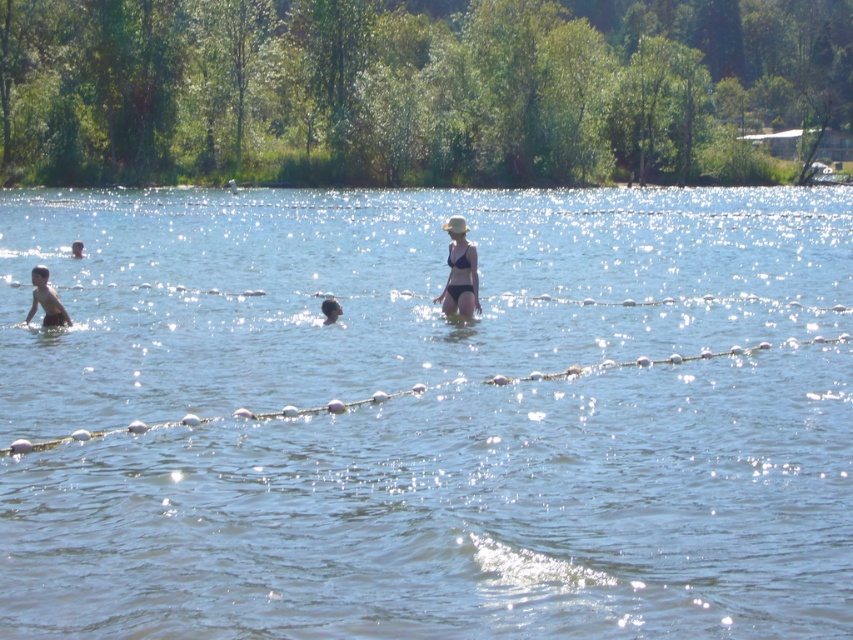
You are a photographer positioned on the lakeside and want to capture both the light brown skin at left and the dark blue swimmer at left in the same frame. Based on their positions, which one would appear closer to the water surface in the photo?

The light brown skin at left appears closer to the water surface because it is located below the dark blue swimmer at left, indicating it is submerged lower in the water.

You are a photographer standing on the lakeside and want to take a photo of both the light brown skin at left and the dark brown hair at center. Which object should you focus on first to ensure both are in sharp focus?

You should focus on the light brown skin at left first since it is closer to the viewer than the dark brown hair at center. By focusing on the closer object, the depth of field may also keep the farther object in focus.

Looking at this image, you are standing at the lakeside and see a point marked at coordinates (45,300). What color of skin is visible at that point?

The point at (45,300) has light brown skin visible there.